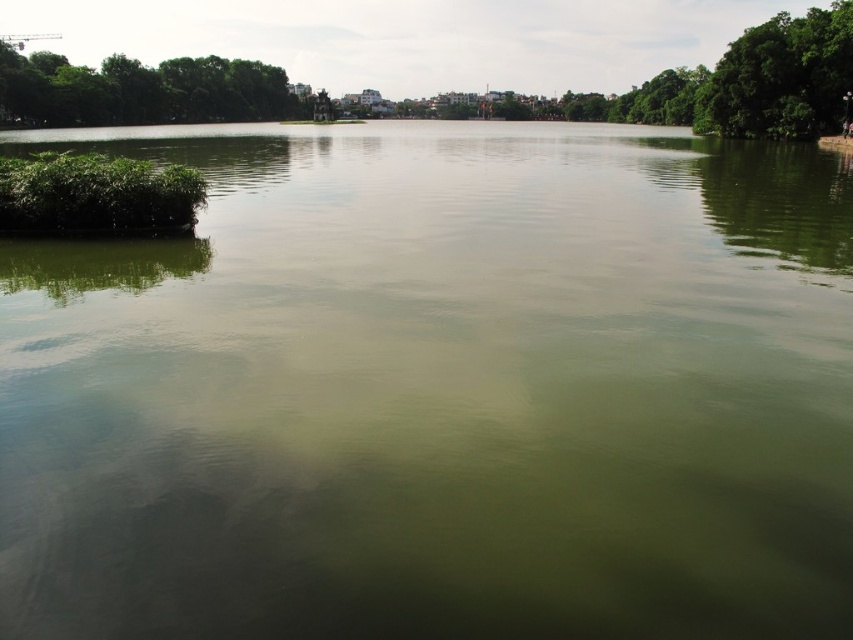
Question: In this image, where is green leafy tree at left located relative to green leafy algae at left?

Choices:
 (A) below
 (B) above

Answer: (B)

Question: Does green leafy tree at left appear under green leafy algae at left?

Choices:
 (A) yes
 (B) no

Answer: (B)

Question: Which object is closer to the camera taking this photo?

Choices:
 (A) green leafy algae at left
 (B) green leafy tree at left

Answer: (A)

Question: Is green leafy tree at left to the right of green leafy algae at left from the viewer's perspective?

Choices:
 (A) yes
 (B) no

Answer: (B)

Question: Which of the following is the farthest from the observer?

Choices:
 (A) (53, 154)
 (B) (288, 92)

Answer: (B)